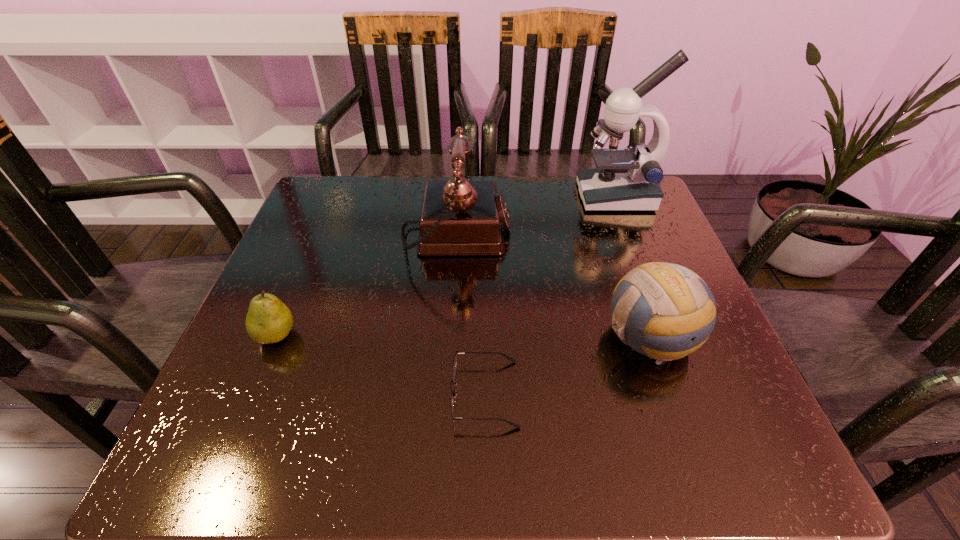
Locate an element on the screen. The height and width of the screenshot is (540, 960). empty location between the telephone and the volleyball is located at coordinates (554, 286).

Where is `free spot between the spectacles and the leftmost object`? The height and width of the screenshot is (540, 960). free spot between the spectacles and the leftmost object is located at coordinates (380, 364).

The height and width of the screenshot is (540, 960). Find the location of `blank region between the third shortest object and the microscope`. blank region between the third shortest object and the microscope is located at coordinates (633, 266).

The height and width of the screenshot is (540, 960). I want to click on free spot between the spectacles and the pear, so click(x=380, y=364).

Where is `free space that is in between the pear and the second tallest object`? The width and height of the screenshot is (960, 540). free space that is in between the pear and the second tallest object is located at coordinates (366, 285).

Locate which object ranks third in proximity to the pear. Please provide its 2D coordinates. Your answer should be formatted as a tuple, i.e. [(x, y)], where the tuple contains the x and y coordinates of a point satisfying the conditions above.

[(665, 311)]

Identify which object is the fourth closest to the third shortest object. Please provide its 2D coordinates. Your answer should be formatted as a tuple, i.e. [(x, y)], where the tuple contains the x and y coordinates of a point satisfying the conditions above.

[(269, 320)]

Find the location of a particular element. This screenshot has width=960, height=540. blank area in the image that satisfies the following two spatial constraints: 1. on the dial of the telephone; 2. on the right side of the third tallest object is located at coordinates (450, 336).

Find the location of a particular element. This screenshot has height=540, width=960. vacant space that satisfies the following two spatial constraints: 1. on the front side of the leftmost object; 2. on the left side of the third shortest object is located at coordinates (276, 336).

At what (x,y) coordinates should I click in order to perform the action: click on free point that satisfies the following two spatial constraints: 1. on the dial of the third shortest object; 2. on the left side of the second tallest object. Please return your answer as a coordinate pair (x, y). Looking at the image, I should click on (450, 336).